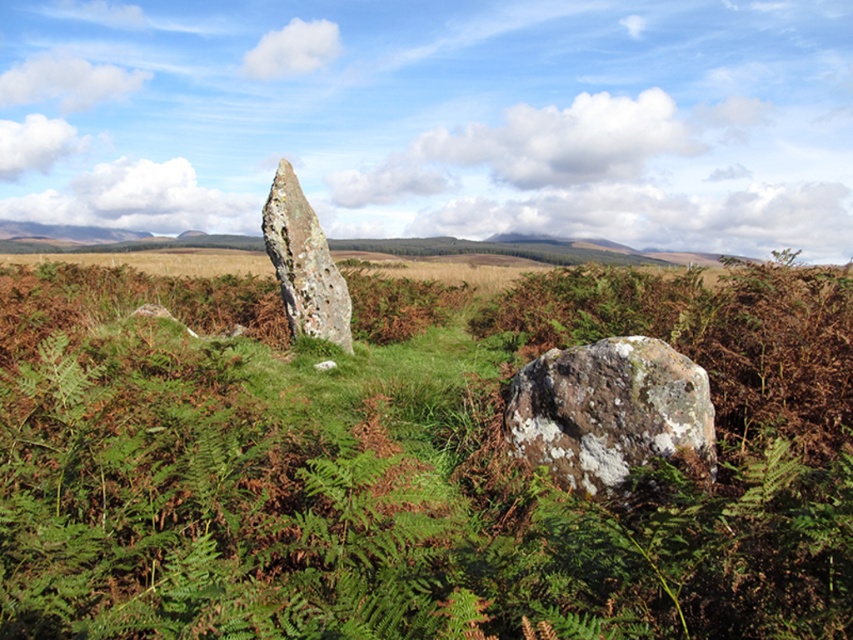
Question: Does speckled rock at center have a greater width compared to speckled stone monolith at center?

Choices:
 (A) yes
 (B) no

Answer: (A)

Question: In this image, where is speckled rock at center located relative to speckled stone monolith at center?

Choices:
 (A) right
 (B) left

Answer: (A)

Question: Which point appears farthest from the camera in this image?

Choices:
 (A) (322, 330)
 (B) (653, 381)

Answer: (A)

Question: Considering the relative positions of speckled rock at center and speckled stone monolith at center in the image provided, where is speckled rock at center located with respect to speckled stone monolith at center?

Choices:
 (A) below
 (B) above

Answer: (A)